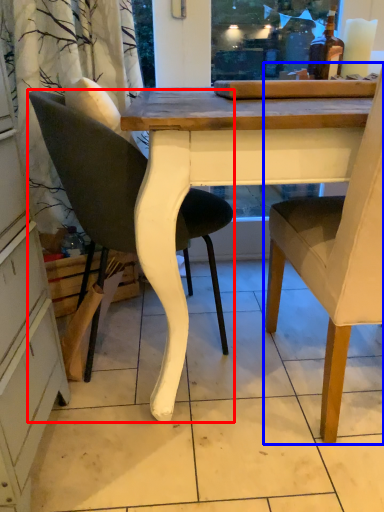
Question: Among these objects, which one is farthest to the camera, chair (highlighted by a red box) or chair (highlighted by a blue box)?

Choices:
 (A) chair
 (B) chair

Answer: (A)